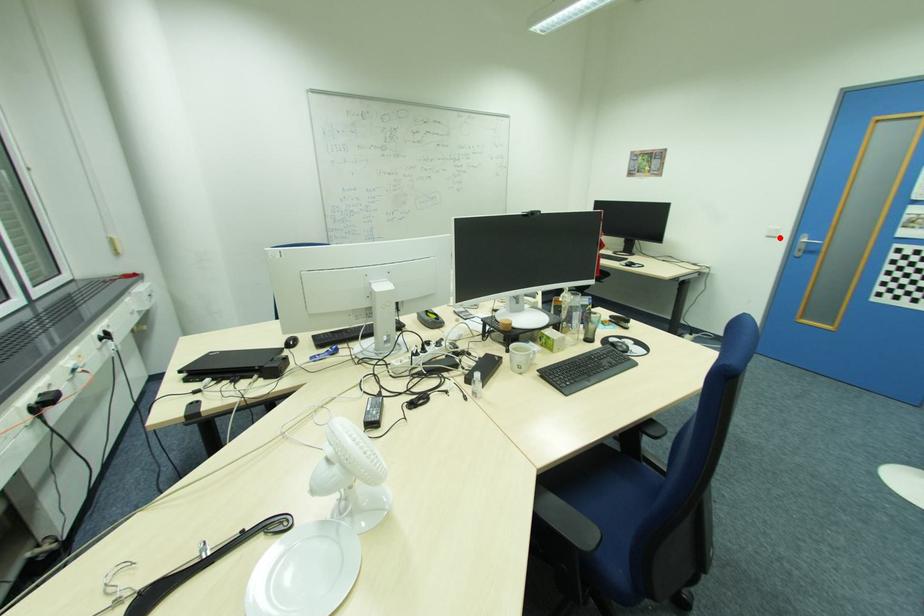
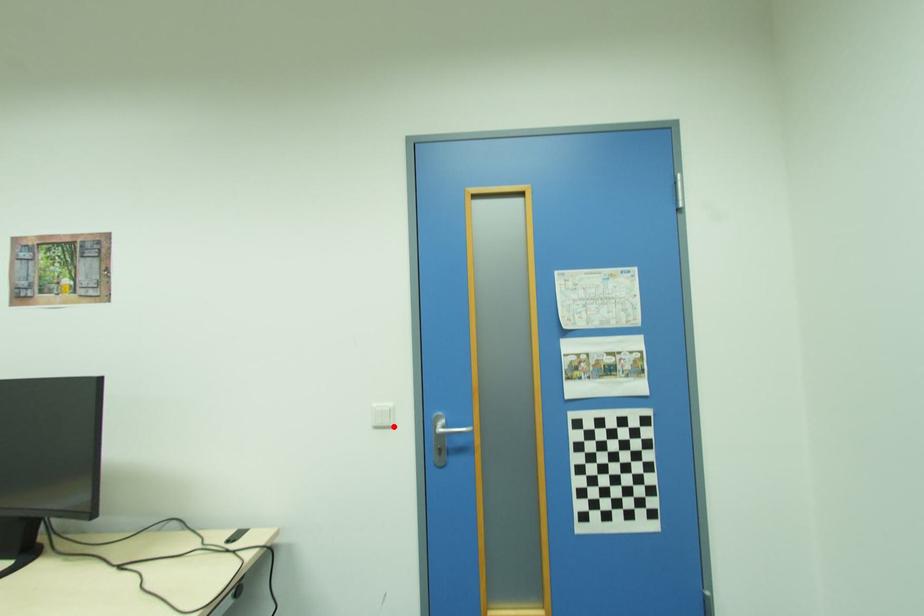
From the picture: I am providing you with two images of the same scene from different viewpoints. A red point is marked on the first image and another point is marked on the second image. Are the points marked in image1 and image2 representing the same 3D position?

Yes